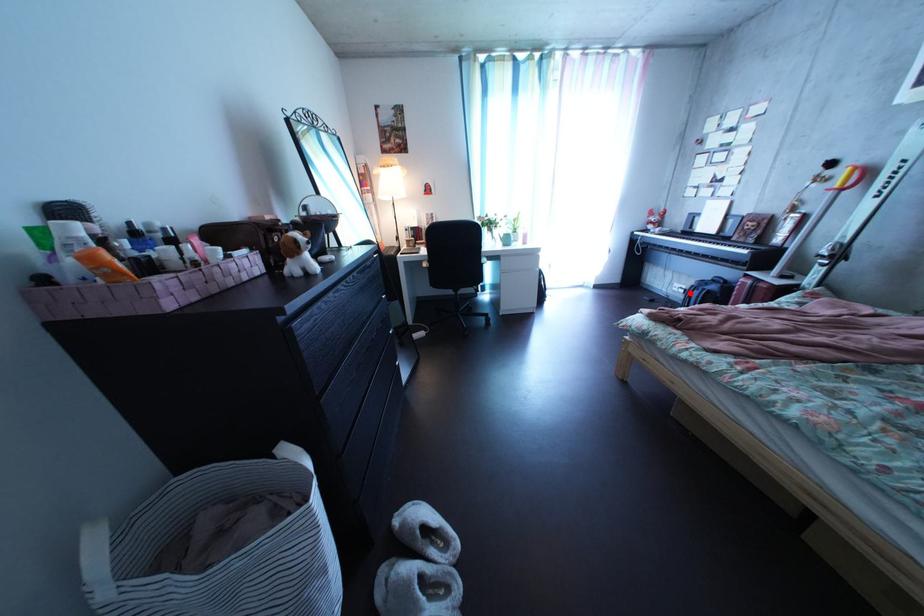
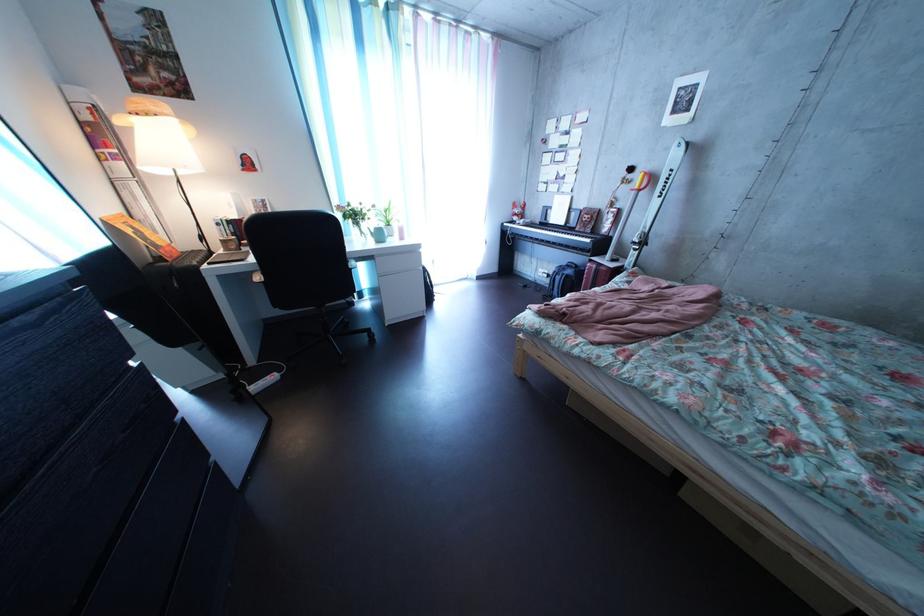
Question: A red point is marked in image1. In image2, is the corresponding 3D point closer to the camera or farther? Reply with the corresponding letter.

Choices:
 (A) The corresponding 3D point is closer.
 (B) The corresponding 3D point is farther.

Answer: (A)